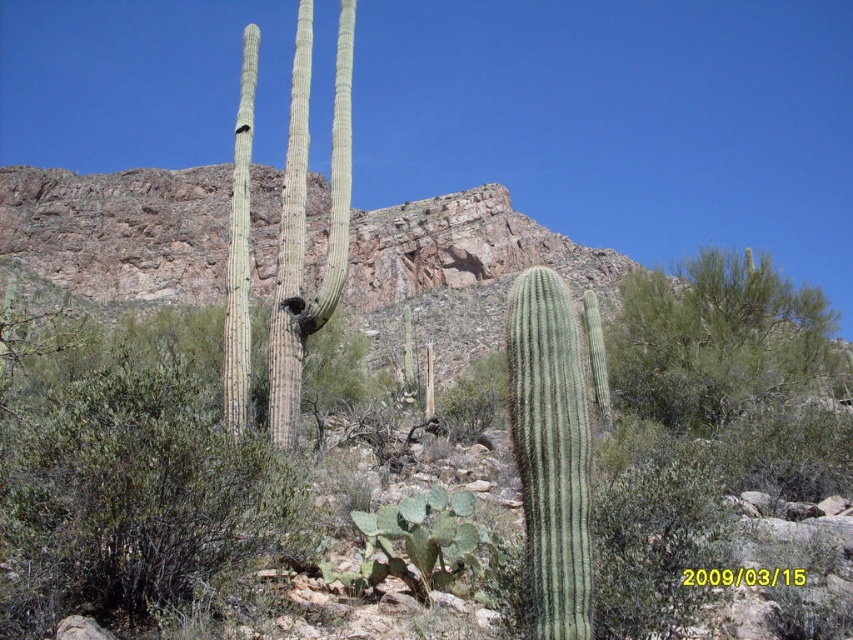
Question: Does green ribbed cactus at center appear on the left side of green spiny cactus at lower center?

Choices:
 (A) no
 (B) yes

Answer: (A)

Question: Is green ribbed cactus at center to the left of green spiny cactus at lower center from the viewer's perspective?

Choices:
 (A) no
 (B) yes

Answer: (A)

Question: Which object is farther from the camera taking this photo?

Choices:
 (A) green spiny cactus at lower center
 (B) green ribbed cactus at center

Answer: (A)

Question: Can you confirm if green ribbed cactus at center is bigger than green spiny cactus at lower center?

Choices:
 (A) yes
 (B) no

Answer: (B)

Question: Which point is closer to the camera?

Choices:
 (A) green ribbed cactus at center
 (B) green spiny cactus at lower center

Answer: (A)